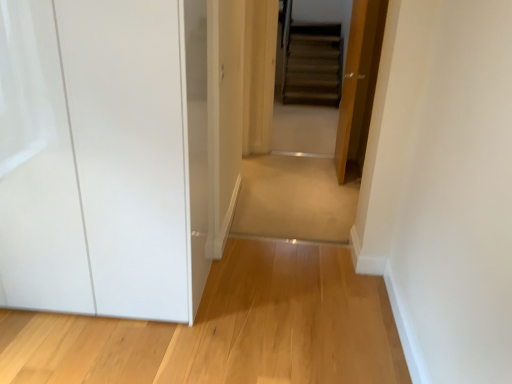
I want to click on empty space that is ontop of light wood floor at lower left, which is counted as the 1th path, starting from the front (from a real-world perspective), so click(x=219, y=330).